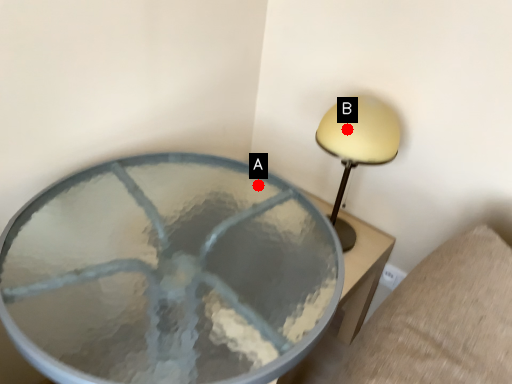
Question: Two points are circled on the image, labeled by A and B beside each circle. Which point is farther from the camera taking this photo?

Choices:
 (A) A is further
 (B) B is further

Answer: (B)